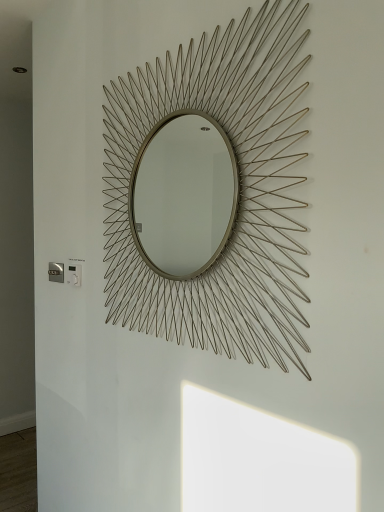
Question: Can you confirm if metallic silver electric outlet at lower left, which is the 2th electric outlet from front to back, is bigger than gold wire sunburst mirror at center?

Choices:
 (A) no
 (B) yes

Answer: (A)

Question: Is metallic silver electric outlet at lower left, which is the first electric outlet in left-to-right order, shorter than gold wire sunburst mirror at center?

Choices:
 (A) no
 (B) yes

Answer: (B)

Question: Does metallic silver electric outlet at lower left, which is the 2th electric outlet from front to back, turn towards gold wire sunburst mirror at center?

Choices:
 (A) yes
 (B) no

Answer: (B)

Question: Can you confirm if metallic silver electric outlet at lower left, which is the 2th electric outlet from front to back, is wider than gold wire sunburst mirror at center?

Choices:
 (A) no
 (B) yes

Answer: (A)

Question: Is metallic silver electric outlet at lower left, which appears as the 1th electric outlet when viewed from the back, taller than gold wire sunburst mirror at center?

Choices:
 (A) yes
 (B) no

Answer: (B)

Question: Does metallic silver electric outlet at lower left, which is the 2th electric outlet from front to back, have a smaller size compared to gold wire sunburst mirror at center?

Choices:
 (A) yes
 (B) no

Answer: (A)

Question: Is white plastic electric outlet at lower left, marked as the first electric outlet in a front-to-back arrangement, thinner than metallic silver electric outlet at lower left, which is the first electric outlet in left-to-right order?

Choices:
 (A) no
 (B) yes

Answer: (A)

Question: Are white plastic electric outlet at lower left, which is counted as the 1th electric outlet, starting from the right, and metallic silver electric outlet at lower left, which is the first electric outlet in left-to-right order, far apart?

Choices:
 (A) yes
 (B) no

Answer: (B)

Question: From the image's perspective, is white plastic electric outlet at lower left, which is counted as the 1th electric outlet, starting from the right, located above metallic silver electric outlet at lower left, which is the 2th electric outlet from front to back?

Choices:
 (A) yes
 (B) no

Answer: (B)

Question: Does white plastic electric outlet at lower left, marked as the first electric outlet in a front-to-back arrangement, have a greater width compared to metallic silver electric outlet at lower left, which is the 2th electric outlet from front to back?

Choices:
 (A) yes
 (B) no

Answer: (A)

Question: From a real-world perspective, is white plastic electric outlet at lower left, which is counted as the 1th electric outlet, starting from the right, over metallic silver electric outlet at lower left, which appears as the 1th electric outlet when viewed from the back?

Choices:
 (A) yes
 (B) no

Answer: (A)

Question: Is white plastic electric outlet at lower left, marked as the first electric outlet in a front-to-back arrangement, shorter than metallic silver electric outlet at lower left, which appears as the 1th electric outlet when viewed from the back?

Choices:
 (A) yes
 (B) no

Answer: (B)

Question: From a real-world perspective, is metallic silver electric outlet at lower left, which is the first electric outlet in left-to-right order, physically above white plastic electric outlet at lower left, marked as the first electric outlet in a front-to-back arrangement?

Choices:
 (A) yes
 (B) no

Answer: (B)